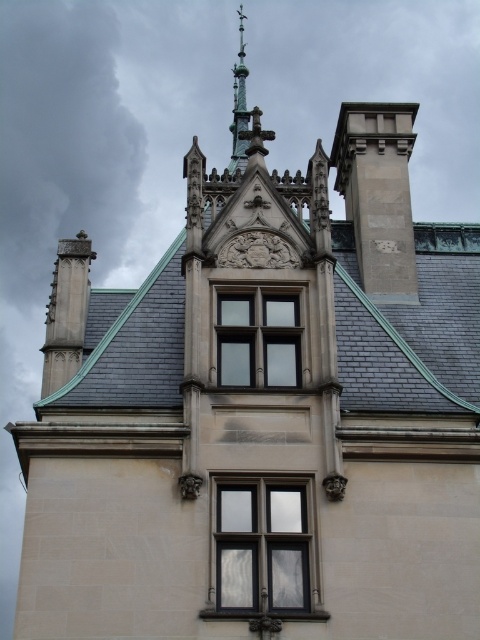
Locate an element on the screen. clear glass window at center is located at coordinates (263, 550).

Is point (289, 492) farther from viewer compared to point (90, 371)?

No, it is not.

At what (x,y) coordinates should I click in order to perform the action: click on clear glass window at center. Please return your answer as a coordinate pair (x, y). The image size is (480, 640). Looking at the image, I should click on (263, 550).

Does matte glass window at center have a greater height compared to gray slate roof at center?

Incorrect, matte glass window at center's height is not larger of gray slate roof at center's.

Based on the photo, does matte glass window at center have a lesser width compared to gray slate roof at center?

Correct, matte glass window at center's width is less than gray slate roof at center's.

Measure the distance between point (277, 356) and camera.

Point (277, 356) is 41.87 meters from camera.

What are the coordinates of `matte glass window at center` in the screenshot? It's located at click(x=257, y=339).

Who is shorter, clear glass window at center or matte glass window at center?

Standing shorter between the two is clear glass window at center.

Is point (309, 538) less distant than point (247, 336)?

Yes, point (309, 538) is closer to viewer.

Where is `clear glass window at center`? clear glass window at center is located at coordinates (263, 550).